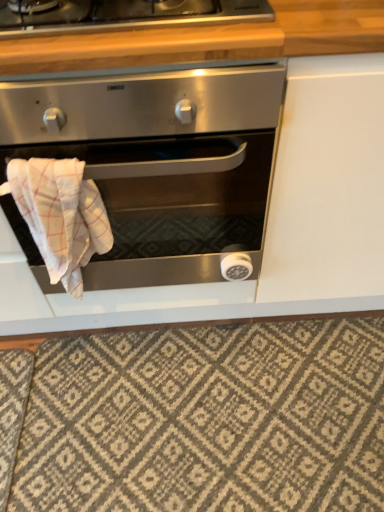
Identify the location of wooden at upper center. (208, 40).

Between satin silver oven at center and wooden at upper center, which one has smaller width?

Thinner between the two is wooden at upper center.

Based on their sizes in the image, would you say satin silver oven at center is bigger or smaller than wooden at upper center?

satin silver oven at center is bigger than wooden at upper center.

From a real-world perspective, is satin silver oven at center over wooden at upper center?

Actually, satin silver oven at center is physically below wooden at upper center in the real world.

Is point (103, 147) farther from viewer compared to point (200, 42)?

Yes, it is behind point (200, 42).

Considering the sizes of objects white checkered cloth at lower left and satin silver oven at center in the image provided, who is taller, white checkered cloth at lower left or satin silver oven at center?

satin silver oven at center is taller.

How different are the orientations of white checkered cloth at lower left and satin silver oven at center in degrees?

white checkered cloth at lower left and satin silver oven at center are facing 0.00144 degrees away from each other.

Is the surface of white checkered cloth at lower left in direct contact with satin silver oven at center?

white checkered cloth at lower left is not next to satin silver oven at center, and they're not touching.

From a real-world perspective, is satin silver oven at center physically below patterned carpet at lower center?

Incorrect, from a real-world perspective, satin silver oven at center is higher than patterned carpet at lower center.

Which is behind, satin silver oven at center or patterned carpet at lower center?

patterned carpet at lower center.

Looking at this image, is satin silver oven at center bigger than patterned carpet at lower center?

Correct, satin silver oven at center is larger in size than patterned carpet at lower center.

Is satin silver oven at center turned away from patterned carpet at lower center?

No.

Consider the image. From the image's perspective, which is below, wooden at upper center or satin silver oven at center?

satin silver oven at center, from the image's perspective.

Is wooden at upper center outside of satin silver oven at center?

Yes, wooden at upper center is outside of satin silver oven at center.

Identify the location of counter top above the satin silver oven at center (from a real-world perspective). This screenshot has width=384, height=512. (208, 40).

How far apart are wooden at upper center and satin silver oven at center?

wooden at upper center is 9.26 inches away from satin silver oven at center.

Is wooden at upper center smaller than white checkered cloth at lower left?

Actually, wooden at upper center might be larger than white checkered cloth at lower left.

Is wooden at upper center closer to the viewer compared to white checkered cloth at lower left?

Yes, it is.

Can you confirm if wooden at upper center is taller than white checkered cloth at lower left?

No.

Does white checkered cloth at lower left have a smaller size compared to patterned carpet at lower center?

Indeed, white checkered cloth at lower left has a smaller size compared to patterned carpet at lower center.

How many degrees apart are the facing directions of white checkered cloth at lower left and patterned carpet at lower center?

The angular difference between white checkered cloth at lower left and patterned carpet at lower center is 0.504 degrees.

Considering the points (93, 191) and (222, 436), which point is behind, point (93, 191) or point (222, 436)?

The point (222, 436) is farther.

Considering the relative positions of white checkered cloth at lower left and patterned carpet at lower center in the image provided, is white checkered cloth at lower left to the right of patterned carpet at lower center from the viewer's perspective?

In fact, white checkered cloth at lower left is to the left of patterned carpet at lower center.

The width and height of the screenshot is (384, 512). I want to click on tile below the white checkered cloth at lower left (from the image's perspective), so click(x=200, y=419).

Is patterned carpet at lower center in contact with white checkered cloth at lower left?

No, patterned carpet at lower center is not making contact with white checkered cloth at lower left.

Can you confirm if patterned carpet at lower center is taller than white checkered cloth at lower left?

Incorrect, the height of patterned carpet at lower center is not larger of that of white checkered cloth at lower left.

In order to click on oven located on the right of wooden at upper center in this screenshot , I will do `click(160, 161)`.

This screenshot has height=512, width=384. What are the coordinates of `bath towel that is on the left side of satin silver oven at center` in the screenshot? It's located at (60, 215).

From the image, which object appears to be nearer to patterned carpet at lower center, satin silver oven at center or wooden at upper center?

Among the two, satin silver oven at center is located nearer to patterned carpet at lower center.

Consider the image. Which object lies further to the anchor point patterned carpet at lower center, white checkered cloth at lower left or satin silver oven at center?

white checkered cloth at lower left lies further to patterned carpet at lower center than the other object.

Estimate the real-world distances between objects in this image. Which object is closer to wooden at upper center, satin silver oven at center or white checkered cloth at lower left?

satin silver oven at center is positioned closer to the anchor wooden at upper center.

Estimate the real-world distances between objects in this image. Which object is closer to satin silver oven at center, patterned carpet at lower center or white checkered cloth at lower left?

The object closer to satin silver oven at center is white checkered cloth at lower left.

Looking at the image, which one is located further to patterned carpet at lower center, satin silver oven at center or white checkered cloth at lower left?

Among the two, white checkered cloth at lower left is located further to patterned carpet at lower center.

Considering their positions, is satin silver oven at center positioned closer to white checkered cloth at lower left than wooden at upper center?

satin silver oven at center is closer to white checkered cloth at lower left.

When comparing their distances from satin silver oven at center, does white checkered cloth at lower left or patterned carpet at lower center seem closer?

Based on the image, white checkered cloth at lower left appears to be nearer to satin silver oven at center.

From the image, which object appears to be farther from satin silver oven at center, patterned carpet at lower center or wooden at upper center?

Based on the image, patterned carpet at lower center appears to be further to satin silver oven at center.

The image size is (384, 512). I want to click on bath towel between wooden at upper center and patterned carpet at lower center from top to bottom, so click(60, 215).

This screenshot has height=512, width=384. I want to click on oven between wooden at upper center and white checkered cloth at lower left in the vertical direction, so click(160, 161).

At what (x,y) coordinates should I click in order to perform the action: click on bath towel between satin silver oven at center and patterned carpet at lower center in the up-down direction. Please return your answer as a coordinate pair (x, y). Looking at the image, I should click on pyautogui.click(x=60, y=215).

Find the location of a particular element. oven between wooden at upper center and patterned carpet at lower center in the vertical direction is located at coordinates click(x=160, y=161).